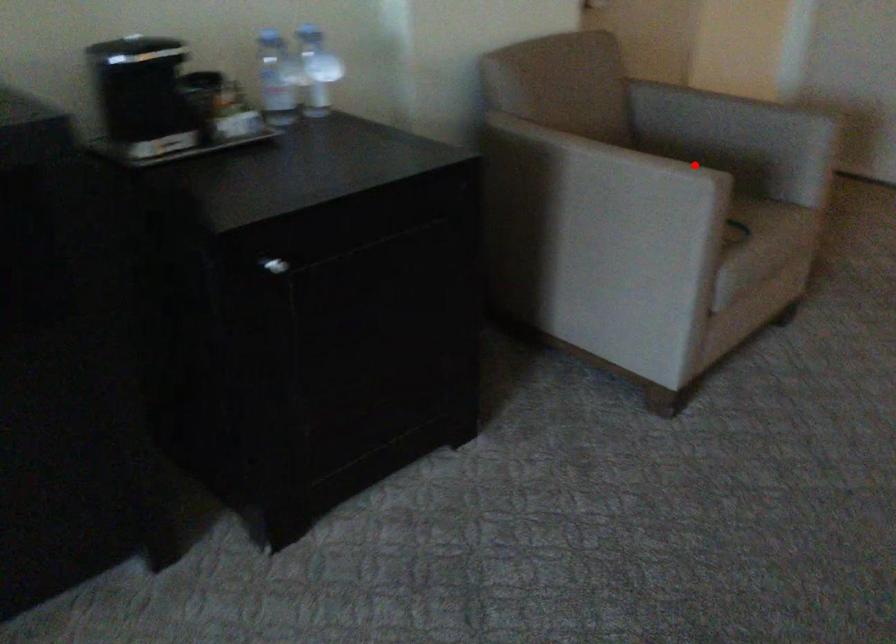
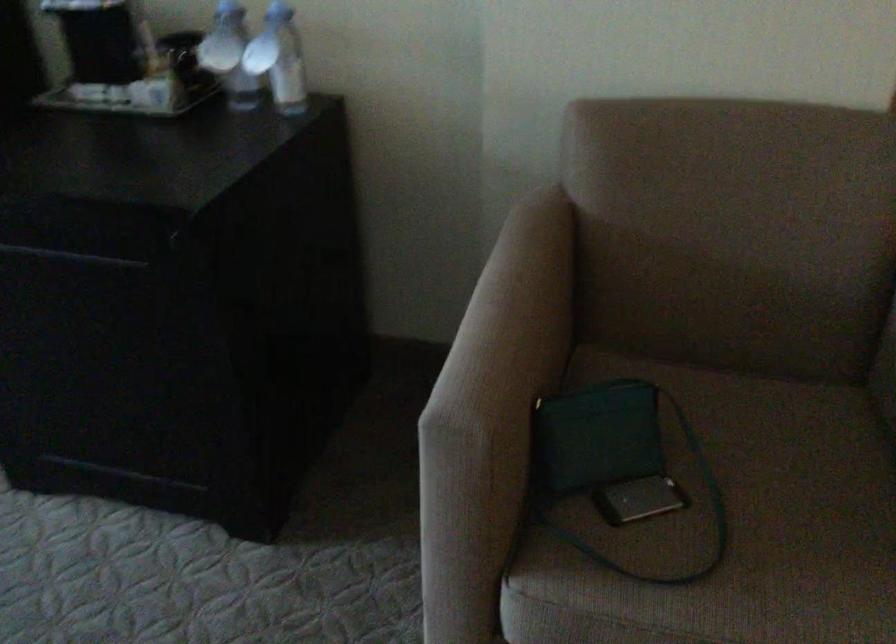
Question: A red point is marked in image1. In image2, is the corresponding 3D point closer to the camera or farther? Reply with the corresponding letter.

Choices:
 (A) The corresponding 3D point is closer.
 (B) The corresponding 3D point is farther.

Answer: (A)